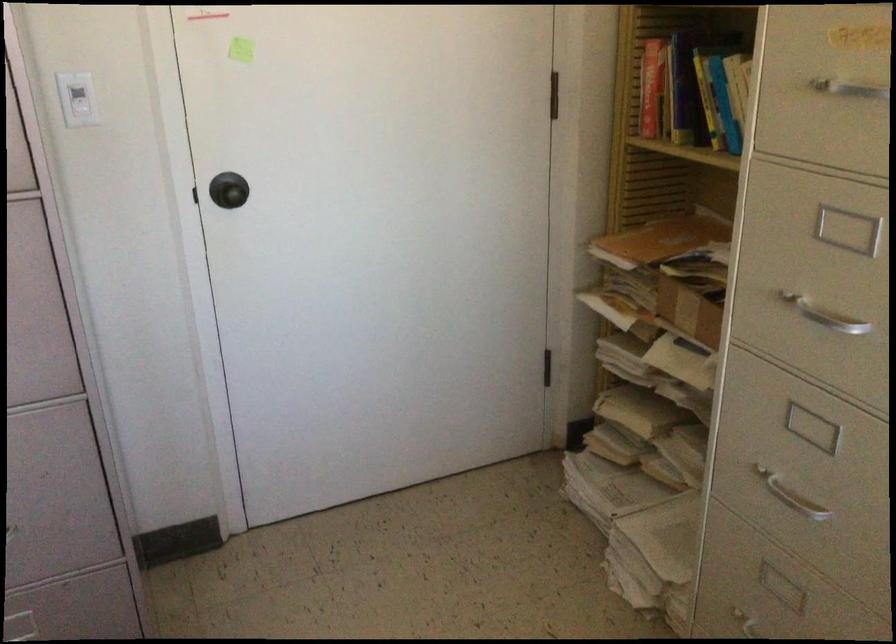
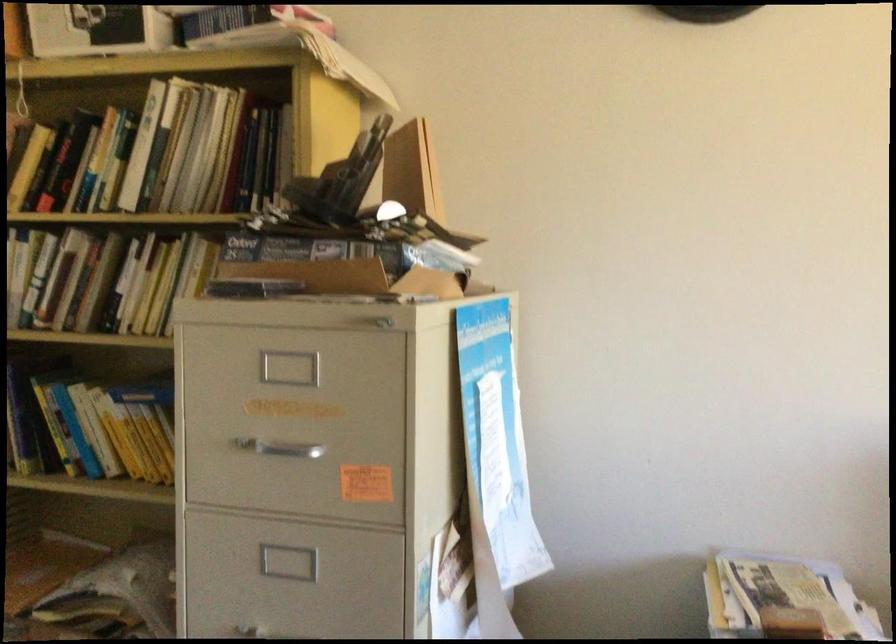
Question: The camera is either moving clockwise (left) or counter-clockwise (right) around the object. The first image is from the beginning of the video and the second image is from the end. Is the camera moving left or right when shooting the video?

Choices:
 (A) Left
 (B) Right

Answer: (A)